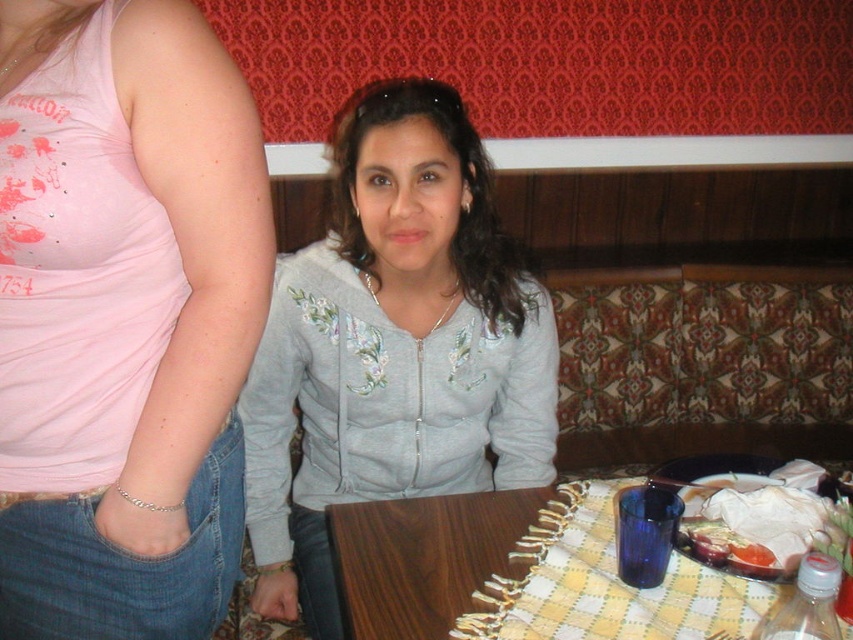
What is located at the coordinates point [393,346]?

The gray fleece jacket at center is located at point [393,346].

You are sitting at the table in the image and want to reach for an item located at point (374,538). Is this point closer to you than the other point at (776,484)?

Yes, the point at (374,538) is closer to you because it is in front of the point at (776,484).

You are a waiter in a restaurant and need to place a new drink order on the table. The table currently has a matte gray hoodie at center and a translucent plastic cup at table right. Where should you place the new drink to avoid covering any existing items?

You should place the new drink on the translucent plastic cup at table right because the matte gray hoodie at center is in front of it, meaning the cup is behind and less obstructed.